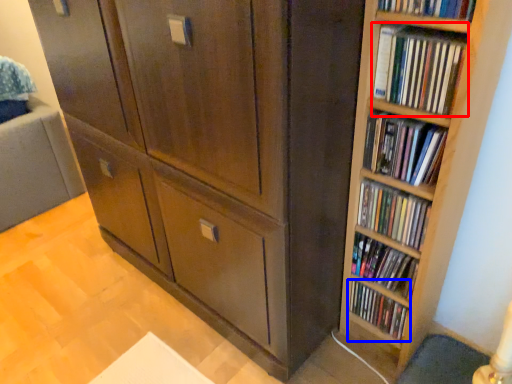
Question: Among these objects, which one is nearest to the camera, book (highlighted by a red box) or book (highlighted by a blue box)?

Choices:
 (A) book
 (B) book

Answer: (A)